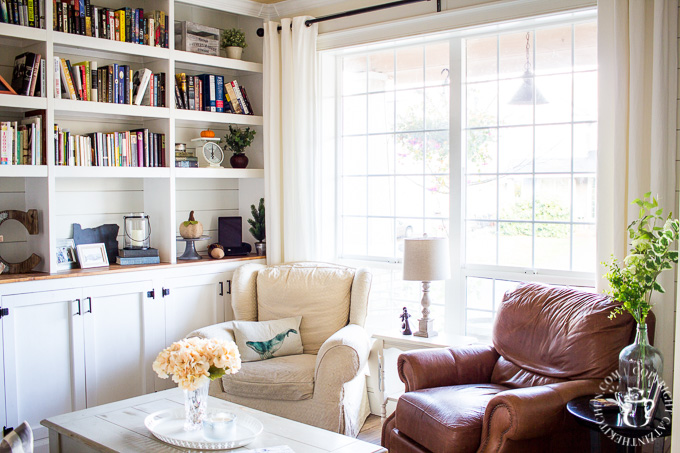
Where is `cabinets`? cabinets is located at coordinates (58, 346), (105, 335), (188, 313), (228, 304).